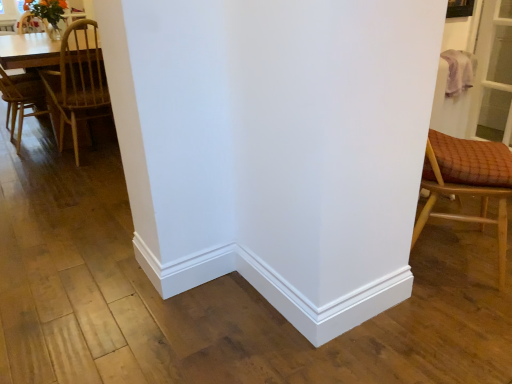
At what (x,y) coordinates should I click in order to perform the action: click on wooden checkered cushion at right, the 1th chair in the right-to-left sequence. Please return your answer as a coordinate pair (x, y). Image resolution: width=512 pixels, height=384 pixels. Looking at the image, I should click on (467, 182).

What are the coordinates of `wooden chair at left, placed as the 2th chair when sorted from front to back` in the screenshot? It's located at (78, 80).

Image resolution: width=512 pixels, height=384 pixels. I want to click on wooden checkered cushion at right, marked as the second chair in a left-to-right arrangement, so click(x=467, y=182).

Measure the distance between wooden checkered cushion at right, the 1th chair in the right-to-left sequence, and wooden chair at left, placed as the 2th chair when sorted from front to back.

wooden checkered cushion at right, the 1th chair in the right-to-left sequence, is 2.30 meters away from wooden chair at left, placed as the 2th chair when sorted from front to back.

Based on the photo, can you confirm if wooden checkered cushion at right, the 1th chair in the right-to-left sequence, is thinner than wooden chair at left, placed as the 2th chair when sorted from front to back?

Indeed, wooden checkered cushion at right, the 1th chair in the right-to-left sequence, has a lesser width compared to wooden chair at left, placed as the 2th chair when sorted from front to back.

Is wooden checkered cushion at right, which is counted as the first chair, starting from the front, placed right next to wooden chair at left, placed as the 2th chair when sorted from front to back?

wooden checkered cushion at right, which is counted as the first chair, starting from the front, is not next to wooden chair at left, placed as the 2th chair when sorted from front to back, and they're not touching.

Is point (458, 158) closer or farther from the camera than point (84, 47)?

Point (458, 158).

Is light brown wooden table at left positioned with its back to wooden chair at left, placed as the 2th chair when sorted from right to left?

No, light brown wooden table at left is not facing the opposite direction of wooden chair at left, placed as the 2th chair when sorted from right to left.

Is point (14, 53) more distant than point (68, 110)?

No, it is not.

Is light brown wooden table at left spatially inside wooden chair at left, placed as the 2th chair when sorted from right to left, or outside of it?

light brown wooden table at left is located beyond the bounds of wooden chair at left, placed as the 2th chair when sorted from right to left.

Considering the sizes of light brown wooden table at left and wooden chair at left, placed as the 2th chair when sorted from front to back, in the image, is light brown wooden table at left taller or shorter than wooden chair at left, placed as the 2th chair when sorted from front to back,?

Clearly, light brown wooden table at left is shorter compared to wooden chair at left, placed as the 2th chair when sorted from front to back.

Between light brown wooden table at left and wooden checkered cushion at right, marked as the second chair in a left-to-right arrangement, which one has more height?

wooden checkered cushion at right, marked as the second chair in a left-to-right arrangement.

Looking at this image, from a real-world perspective, which object rests below the other?

light brown wooden table at left, from a real-world perspective.

Considering the sizes of objects light brown wooden table at left and wooden checkered cushion at right, marked as the second chair in a left-to-right arrangement, in the image provided, who is wider, light brown wooden table at left or wooden checkered cushion at right, marked as the second chair in a left-to-right arrangement,?

light brown wooden table at left is wider.

From the image's perspective, which one is positioned higher, light brown wooden table at left or wooden checkered cushion at right, which is counted as the first chair, starting from the front?

light brown wooden table at left appears higher in the image.

Is wooden chair at left, placed as the 2th chair when sorted from right to left, not inside wooden checkered cushion at right, which is counted as the first chair, starting from the front?

Absolutely, wooden chair at left, placed as the 2th chair when sorted from right to left, is external to wooden checkered cushion at right, which is counted as the first chair, starting from the front.

Is wooden chair at left, placed as the 2th chair when sorted from right to left, touching wooden checkered cushion at right, the 1th chair in the right-to-left sequence?

There is a gap between wooden chair at left, placed as the 2th chair when sorted from right to left, and wooden checkered cushion at right, the 1th chair in the right-to-left sequence.

Where is `chair that appears behind the wooden checkered cushion at right, the 1th chair in the right-to-left sequence`? The height and width of the screenshot is (384, 512). chair that appears behind the wooden checkered cushion at right, the 1th chair in the right-to-left sequence is located at coordinates (78, 80).

Based on the photo, who is bigger, wooden checkered cushion at right, marked as the second chair in a left-to-right arrangement, or light brown wooden table at left?

With larger size is light brown wooden table at left.

Considering the positions of objects wooden checkered cushion at right, marked as the second chair in a left-to-right arrangement, and light brown wooden table at left in the image provided, who is more to the left, wooden checkered cushion at right, marked as the second chair in a left-to-right arrangement, or light brown wooden table at left?

light brown wooden table at left.

From the image's perspective, between wooden checkered cushion at right, arranged as the second chair when viewed from the back, and light brown wooden table at left, which one is located above?

From the image's view, light brown wooden table at left is above.

Does point (482, 207) appear closer or farther from the camera than point (15, 35)?

Point (482, 207) is closer to the camera than point (15, 35).

What's the angular difference between wooden chair at left, positioned as the 1th chair in left-to-right order, and light brown wooden table at left's facing directions?

They differ by 90 degrees in their facing directions.

From the image's perspective, relative to light brown wooden table at left, is wooden chair at left, positioned as the 1th chair in left-to-right order, above or below?

Clearly, from the image's perspective, wooden chair at left, positioned as the 1th chair in left-to-right order, is below light brown wooden table at left.

In order to click on table below the wooden chair at left, positioned as the 1th chair in left-to-right order (from a real-world perspective) in this screenshot , I will do `click(28, 51)`.

Between wooden chair at left, placed as the 2th chair when sorted from right to left, and light brown wooden table at left, which one has less height?

light brown wooden table at left is shorter.

You are a GUI agent. You are given a task and a screenshot of the screen. Output one action in this format:
    pyautogui.click(x=<x>, y=<y>)
    Task: Click on the chair located on the left of wooden checkered cushion at right, the 1th chair in the right-to-left sequence
    
    Given the screenshot: What is the action you would take?
    pyautogui.click(x=78, y=80)

Which chair is the 1st one when counting from the front of the light brown wooden table at left? Please provide its 2D coordinates.

[(78, 80)]

Based on their spatial positions, is light brown wooden table at left or wooden chair at left, placed as the 2th chair when sorted from right to left, closer to wooden checkered cushion at right, arranged as the second chair when viewed from the back?

Based on the image, wooden chair at left, placed as the 2th chair when sorted from right to left, appears to be nearer to wooden checkered cushion at right, arranged as the second chair when viewed from the back.

Considering their positions, is light brown wooden table at left positioned further to wooden chair at left, placed as the 2th chair when sorted from front to back, than wooden checkered cushion at right, arranged as the second chair when viewed from the back?

wooden checkered cushion at right, arranged as the second chair when viewed from the back, lies further to wooden chair at left, placed as the 2th chair when sorted from front to back, than the other object.

From the image, which object appears to be nearer to light brown wooden table at left, wooden chair at left, positioned as the 1th chair in left-to-right order, or wooden checkered cushion at right, arranged as the second chair when viewed from the back?

wooden chair at left, positioned as the 1th chair in left-to-right order, lies closer to light brown wooden table at left than the other object.

Looking at the image, which one is located closer to wooden chair at left, placed as the 2th chair when sorted from right to left, wooden checkered cushion at right, which is counted as the first chair, starting from the front, or light brown wooden table at left?

light brown wooden table at left is positioned closer to the anchor wooden chair at left, placed as the 2th chair when sorted from right to left.

Based on their spatial positions, is wooden chair at left, positioned as the 1th chair in left-to-right order, or light brown wooden table at left closer to wooden checkered cushion at right, the 1th chair in the right-to-left sequence?

wooden chair at left, positioned as the 1th chair in left-to-right order, is closer to wooden checkered cushion at right, the 1th chair in the right-to-left sequence.

In the scene shown: Looking at the image, which one is located closer to light brown wooden table at left, wooden checkered cushion at right, which is counted as the first chair, starting from the front, or wooden chair at left, positioned as the 1th chair in left-to-right order?

wooden chair at left, positioned as the 1th chair in left-to-right order, lies closer to light brown wooden table at left than the other object.

In order to click on chair between light brown wooden table at left and wooden checkered cushion at right, arranged as the second chair when viewed from the back, from left to right in this screenshot , I will do `click(78, 80)`.